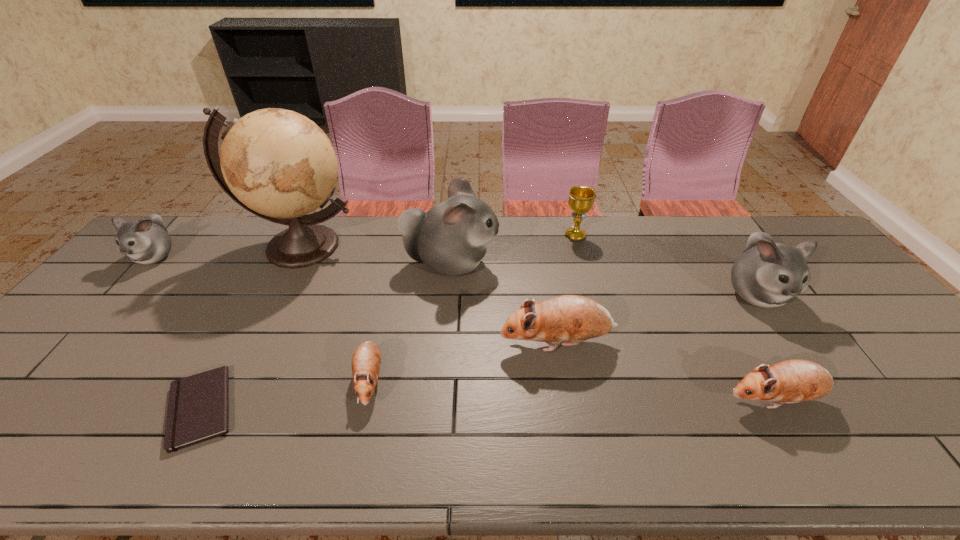
At what (x,y) coordinates should I click in order to perform the action: click on vacant region located 0.380m at the face of the biggest brown hamster. Please return your answer as a coordinate pair (x, y). Image resolution: width=960 pixels, height=540 pixels. Looking at the image, I should click on (353, 343).

In order to click on free space located at the face of the biggest brown hamster in this screenshot , I will do `click(384, 343)`.

This screenshot has width=960, height=540. Find the location of `free space located at the face of the rightmost brown hamster`. free space located at the face of the rightmost brown hamster is located at coordinates (697, 400).

You are a GUI agent. You are given a task and a screenshot of the screen. Output one action in this format:
    pyautogui.click(x=<x>, y=<y>)
    Task: Click on the vacant point located at the face of the rightmost brown hamster
    
    Given the screenshot: What is the action you would take?
    pyautogui.click(x=701, y=400)

This screenshot has width=960, height=540. What are the coordinates of `free region located 0.100m at the face of the rightmost brown hamster` in the screenshot? It's located at (680, 400).

The height and width of the screenshot is (540, 960). I want to click on free space located at the face of the leftmost brown hamster, so click(x=350, y=461).

This screenshot has height=540, width=960. Identify the location of free space located on the left of the checkbook. (134, 408).

Where is `globe positioned at the far edge`? The image size is (960, 540). globe positioned at the far edge is located at coordinates (279, 165).

I want to click on chalice positioned at the far edge, so click(x=581, y=199).

The image size is (960, 540). I want to click on object that is at the near edge, so pyautogui.click(x=198, y=408).